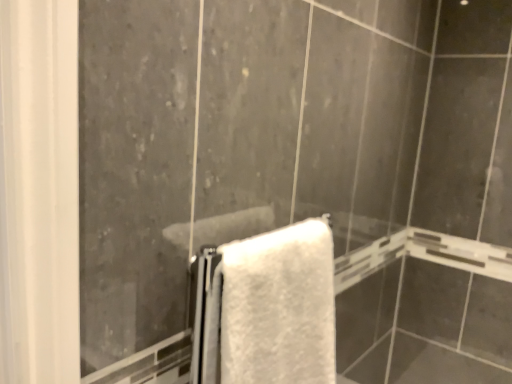
Locate an element on the screen. This screenshot has width=512, height=384. white fluffy towel at center is located at coordinates 279,306.

This screenshot has width=512, height=384. What do you see at coordinates (279, 306) in the screenshot?
I see `white fluffy towel at center` at bounding box center [279, 306].

This screenshot has height=384, width=512. I want to click on white fluffy towel at center, so click(x=279, y=306).